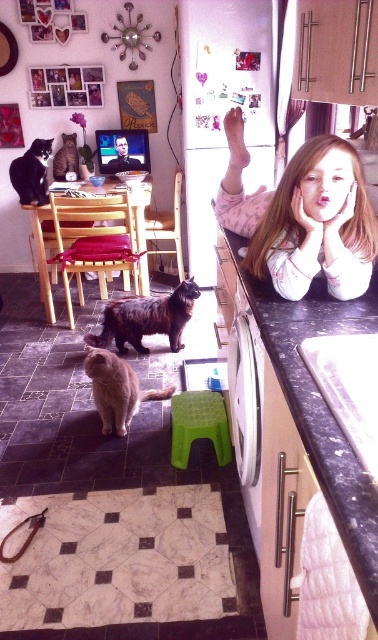
Does green plastic stool at lower center appear on the left side of black fur cat at left?

No, green plastic stool at lower center is not to the left of black fur cat at left.

Does point (184, 456) lie in front of point (26, 173)?

Yes.

Identify the location of green plastic stool at lower center. (198, 426).

Is smooth skin girl at upper right to the left of orange fur cat at center from the viewer's perspective?

In fact, smooth skin girl at upper right is to the right of orange fur cat at center.

Between point (354, 246) and point (116, 429), which one is positioned in front?

Positioned in front is point (354, 246).

The width and height of the screenshot is (378, 640). Identify the location of smooth skin girl at upper right. (303, 216).

Who is shorter, dark brown shaggy cat at center or green plastic stool at lower center?

Standing shorter between the two is green plastic stool at lower center.

Can you confirm if dark brown shaggy cat at center is positioned to the left of green plastic stool at lower center?

Correct, you'll find dark brown shaggy cat at center to the left of green plastic stool at lower center.

Does point (167, 330) lie behind point (196, 401)?

That is True.

Locate an element on the screen. The width and height of the screenshot is (378, 640). dark brown shaggy cat at center is located at coordinates (147, 317).